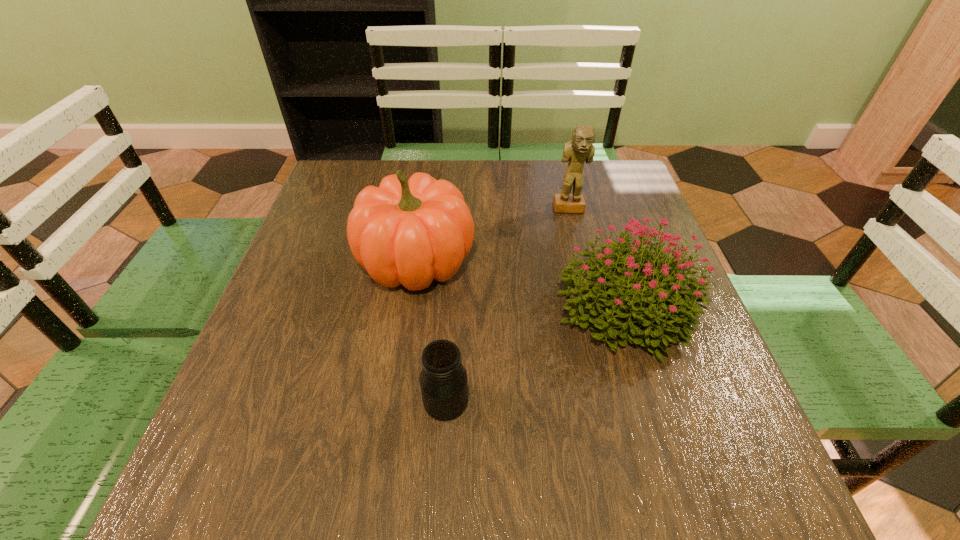
Where is `object that is at the left edge`? The height and width of the screenshot is (540, 960). object that is at the left edge is located at coordinates (404, 232).

Where is `object at the right edge`? object at the right edge is located at coordinates (650, 313).

The width and height of the screenshot is (960, 540). Identify the location of blank space at the far edge of the desktop. (463, 168).

At what (x,y) coordinates should I click in order to perform the action: click on vacant point at the near edge. Please return your answer as a coordinate pair (x, y). Image resolution: width=960 pixels, height=540 pixels. Looking at the image, I should click on (496, 508).

This screenshot has width=960, height=540. In order to click on vacant space at the left edge of the desktop in this screenshot , I will do `click(342, 255)`.

This screenshot has width=960, height=540. In the image, there is a desktop. Identify the location of vacant space at the right edge. (734, 414).

Find the location of `vacant space at the near left corner`. vacant space at the near left corner is located at coordinates (215, 462).

Find the location of a particular element. This screenshot has height=540, width=960. vacant space at the far right corner is located at coordinates (604, 172).

In the image, there is a desktop. Where is `vacant region at the near right corner`? vacant region at the near right corner is located at coordinates (685, 453).

Where is `unoccupied area between the pumpkin and the figurine`? This screenshot has width=960, height=540. unoccupied area between the pumpkin and the figurine is located at coordinates (493, 235).